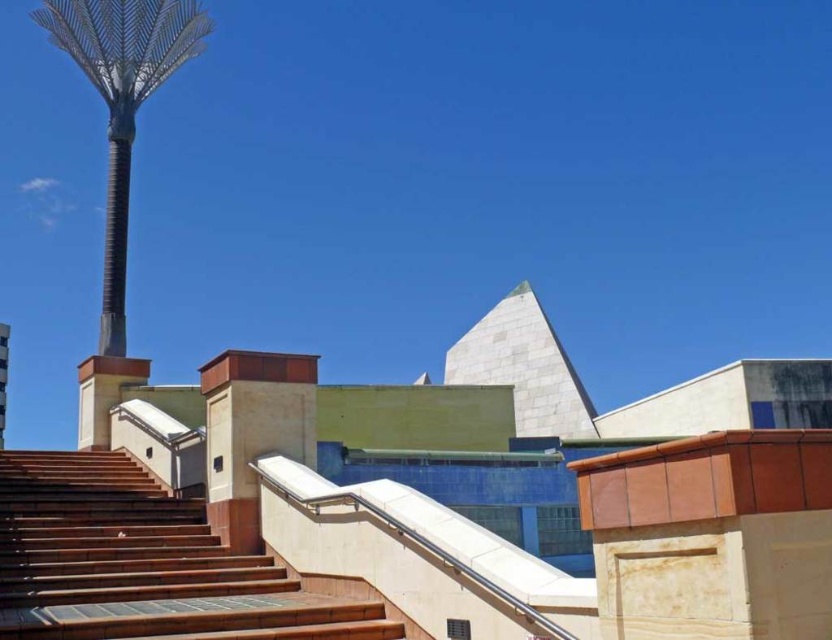
You are standing at the base of the wooden stairs at lower left and want to reach the entrance of the building. The entrance is located near the white marble pyramid at upper center. Which direction should you walk to get there?

You should walk upwards towards the white marble pyramid at upper center since the wooden stairs at lower left are positioned under it, indicating the path leads upward toward the pyramid.

You are standing at the base of the wooden stairs at lower left and want to reach the brown metallic pole at upper left. Which direction should you move to get closer to the pole?

You should move upward along the wooden stairs at lower left to get closer to the brown metallic pole at upper left since the stairs are in front of the pole, indicating they lead towards it.

You are standing at the point marked at (244, 605) in the image. You want to walk to the pyramid structure. The path is straight but has a slope. If the slope is 15 degrees, will you be walking uphill or downhill?

Result: Since the point marked at (244, 605) is 27.84 feet away from the pyramid structure, and the slope is 15 degrees, you will be walking uphill towards the pyramid structure.